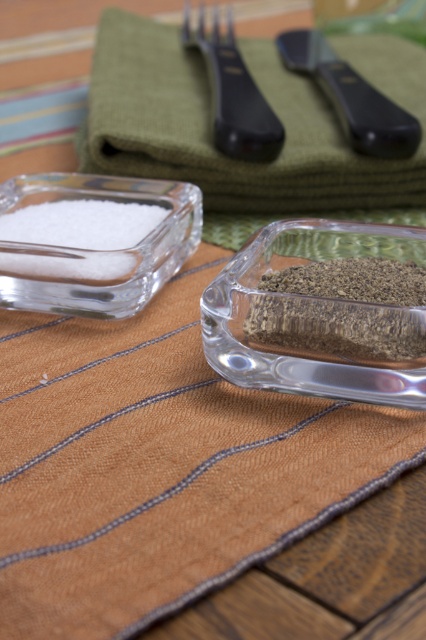
Which of these two, white crystalline salt at left or black plastic knife at upper center, stands shorter?

Standing shorter between the two is white crystalline salt at left.

Who is more forward, (54,232) or (362,138)?

Point (54,232)

I want to click on white crystalline salt at left, so click(78, 236).

Is the position of dark brown granular spice at center more distant than that of black plastic knife at upper center?

No, it is in front of black plastic knife at upper center.

Locate an element on the screen. The width and height of the screenshot is (426, 640). dark brown granular spice at center is located at coordinates pyautogui.click(x=342, y=310).

What do you see at coordinates (78, 236) in the screenshot?
I see `white crystalline salt at left` at bounding box center [78, 236].

Which is more to the left, white crystalline salt at left or black plastic fork at upper center?

white crystalline salt at left is more to the left.

In the scene shown: Who is more forward, (123, 236) or (245, 67)?

Point (123, 236) is in front.

Where is `white crystalline salt at left`? white crystalline salt at left is located at coordinates (78, 236).